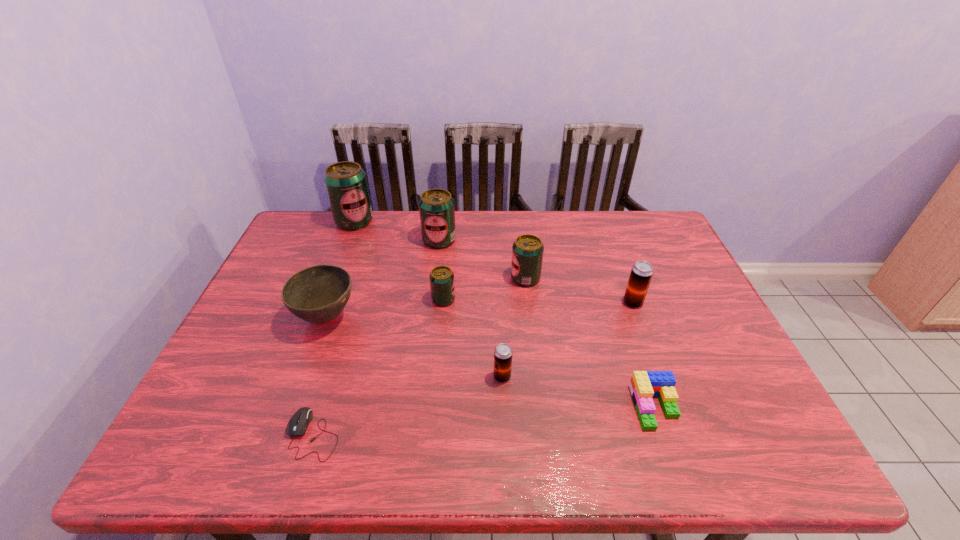
At what (x,y) coordinates should I click in order to perform the action: click on vacant space in between the bigger black beer can and the leftmost green beer can. Please return your answer as a coordinate pair (x, y). Looking at the image, I should click on (493, 262).

Find the location of `vacant space that is in between the smallest green beer can and the computer mouse`. vacant space that is in between the smallest green beer can and the computer mouse is located at coordinates (378, 367).

Locate an element on the screen. vacant space that's between the right black beer can and the computer mouse is located at coordinates (473, 368).

Where is `vacant area that lies between the fifth beer can from left to right and the computer mouse`? The width and height of the screenshot is (960, 540). vacant area that lies between the fifth beer can from left to right and the computer mouse is located at coordinates (420, 356).

Locate an element on the screen. Image resolution: width=960 pixels, height=540 pixels. vacant space in between the nearest green beer can and the computer mouse is located at coordinates (378, 367).

Choose which object is the seventh nearest neighbor to the Lego. Please provide its 2D coordinates. Your answer should be formatted as a tuple, i.e. [(x, y)], where the tuple contains the x and y coordinates of a point satisfying the conditions above.

[(318, 294)]

Point out which object is positioned as the fourth nearest to the third nearest object. Please provide its 2D coordinates. Your answer should be formatted as a tuple, i.e. [(x, y)], where the tuple contains the x and y coordinates of a point satisfying the conditions above.

[(297, 425)]

Select which beer can appears as the closest to the smallest green beer can. Please provide its 2D coordinates. Your answer should be formatted as a tuple, i.e. [(x, y)], where the tuple contains the x and y coordinates of a point satisfying the conditions above.

[(527, 250)]

This screenshot has width=960, height=540. I want to click on beer can that stands as the sixth closest to the bowl, so click(641, 274).

Point out which green beer can is positioned as the nearest to the leftmost beer can. Please provide its 2D coordinates. Your answer should be formatted as a tuple, i.e. [(x, y)], where the tuple contains the x and y coordinates of a point satisfying the conditions above.

[(436, 206)]